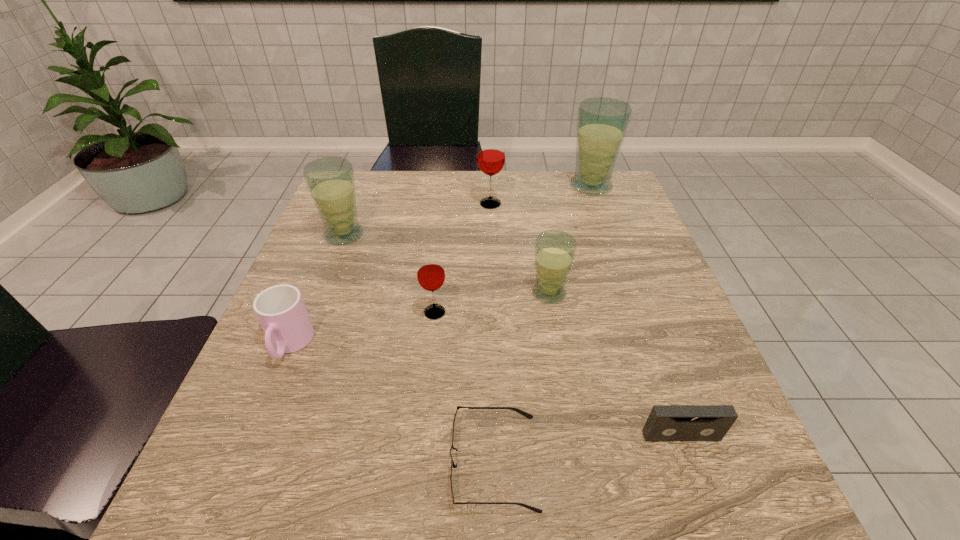
Identify the location of free space between the seventh tallest object and the fourth glass from left to right. (615, 364).

Locate an element on the screen. free spot between the third shortest object and the second shortest object is located at coordinates (486, 390).

Find the location of a particular element. This screenshot has width=960, height=540. vacant space that is in between the leftmost blue glass and the cup is located at coordinates (317, 290).

Where is `unoccupied area between the second shortest object and the third glass from left to right`? The width and height of the screenshot is (960, 540). unoccupied area between the second shortest object and the third glass from left to right is located at coordinates tap(586, 320).

Locate an element on the screen. Image resolution: width=960 pixels, height=540 pixels. the sixth closest object to the cup is located at coordinates (665, 422).

Identify which object is the sixth nearest to the cup. Please provide its 2D coordinates. Your answer should be formatted as a tuple, i.e. [(x, y)], where the tuple contains the x and y coordinates of a point satisfying the conditions above.

[(665, 422)]

Find the location of `glass that is the fourth closest to the second blue glass from left to right`. glass that is the fourth closest to the second blue glass from left to right is located at coordinates (330, 181).

At what (x,y) coordinates should I click in order to perform the action: click on glass that is the third closest to the leftmost glass. Please return your answer as a coordinate pair (x, y). This screenshot has width=960, height=540. Looking at the image, I should click on (555, 250).

Where is `the third closest blue glass relative to the left red glass`? the third closest blue glass relative to the left red glass is located at coordinates (602, 122).

Point out which blue glass is positioned as the nearest to the farthest blue glass. Please provide its 2D coordinates. Your answer should be formatted as a tuple, i.e. [(x, y)], where the tuple contains the x and y coordinates of a point satisfying the conditions above.

[(555, 250)]